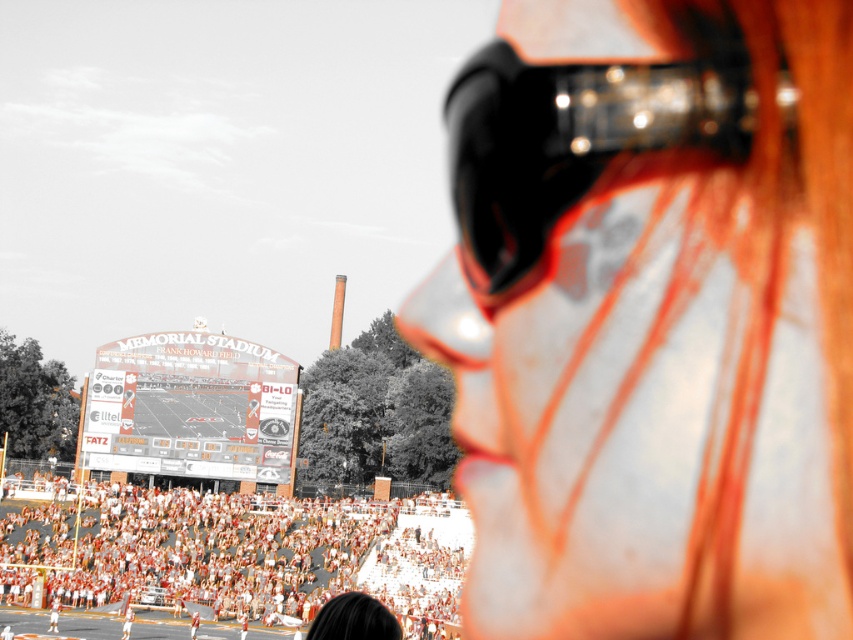
Is point (114, 504) positioned after point (608, 99)?

Yes, point (114, 504) is behind point (608, 99).

Can you confirm if white fabric crowd at lower center is positioned to the left of black glossy goggles at upper right?

Yes, white fabric crowd at lower center is to the left of black glossy goggles at upper right.

Is point (358, 552) positioned before point (459, 120)?

No, it is not.

At what (x,y) coordinates should I click in order to perform the action: click on white fabric crowd at lower center. Please return your answer as a coordinate pair (x, y). Looking at the image, I should click on (239, 556).

Can you confirm if matte orange helmet at center is wider than black glossy goggles at upper right?

Yes, matte orange helmet at center is wider than black glossy goggles at upper right.

Which is below, matte orange helmet at center or black glossy goggles at upper right?

matte orange helmet at center is lower down.

Does point (657, 614) come behind point (444, 109)?

No, it is not.

The image size is (853, 640). Find the location of `matte orange helmet at center`. matte orange helmet at center is located at coordinates (653, 317).

Identify the location of matte orange helmet at center. This screenshot has height=640, width=853. (653, 317).

Is point (654, 99) behind point (32, 564)?

No, it is in front of (32, 564).

Which is in front, point (509, 179) or point (90, 556)?

Point (509, 179) is more forward.

The height and width of the screenshot is (640, 853). In order to click on matte orange helmet at center in this screenshot , I will do `click(653, 317)`.